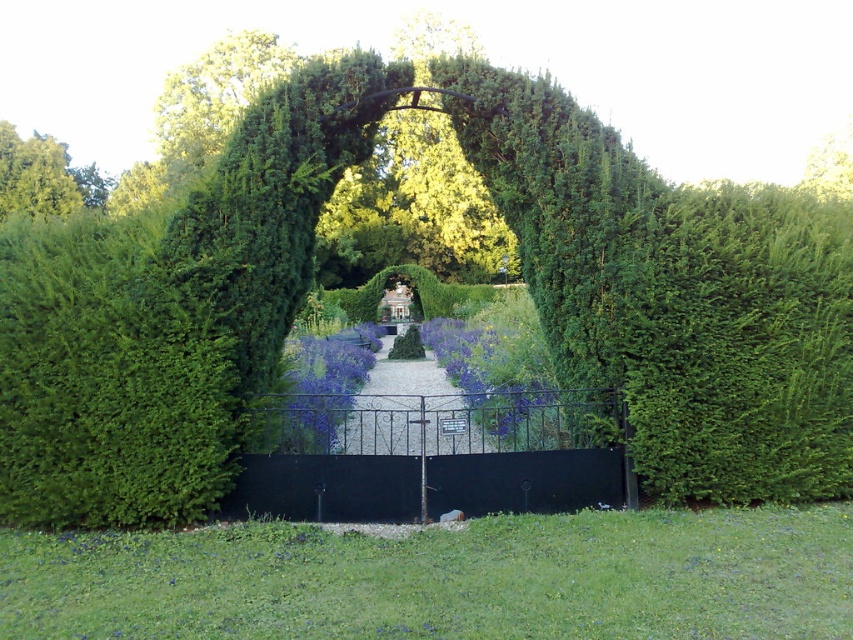
Question: Which point is closer to the camera?

Choices:
 (A) (380, 493)
 (B) (402, 404)

Answer: (A)

Question: Can you confirm if black wrought iron gate at center is bigger than gravel path at center?

Choices:
 (A) no
 (B) yes

Answer: (A)

Question: From the image, what is the correct spatial relationship of black wrought iron gate at center in relation to gravel path at center?

Choices:
 (A) left
 (B) right

Answer: (B)

Question: Estimate the real-world distances between objects in this image. Which object is closer to the green grass at lower center?

Choices:
 (A) green leafy bush at center
 (B) black wrought iron gate at center

Answer: (A)

Question: Estimate the real-world distances between objects in this image. Which object is farther from the green leafy bush at center?

Choices:
 (A) green grass at lower center
 (B) gravel path at center

Answer: (B)

Question: Can you confirm if green leafy bush at center is positioned to the right of black wrought iron gate at center?

Choices:
 (A) no
 (B) yes

Answer: (A)